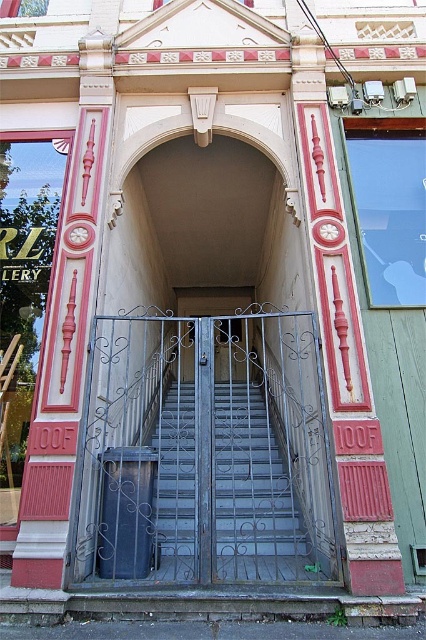
Does dark gray wrought iron gate at center appear under metallic gray gate at center?

Correct, dark gray wrought iron gate at center is located below metallic gray gate at center.

Is dark gray wrought iron gate at center wider than metallic gray gate at center?

In fact, dark gray wrought iron gate at center might be narrower than metallic gray gate at center.

Which is in front, point (213, 404) or point (233, 358)?

Point (213, 404) is more forward.

Find the location of a particular element. dark gray wrought iron gate at center is located at coordinates (206, 451).

Which is below, metallic gray stairs at center or metallic gray gate at center?

metallic gray stairs at center is below.

Is point (160, 440) positioned before point (213, 300)?

Yes, point (160, 440) is closer to viewer.

Between point (250, 474) and point (184, 356), which one is positioned behind?

The point (184, 356) is more distant.

The height and width of the screenshot is (640, 426). I want to click on metallic gray stairs at center, so click(x=250, y=492).

Does dark gray wrought iron gate at center have a smaller size compared to metallic gray stairs at center?

Indeed, dark gray wrought iron gate at center has a smaller size compared to metallic gray stairs at center.

Can you confirm if dark gray wrought iron gate at center is thinner than metallic gray stairs at center?

Yes, dark gray wrought iron gate at center is thinner than metallic gray stairs at center.

Where is `dark gray wrought iron gate at center`? The width and height of the screenshot is (426, 640). dark gray wrought iron gate at center is located at coordinates (206, 451).